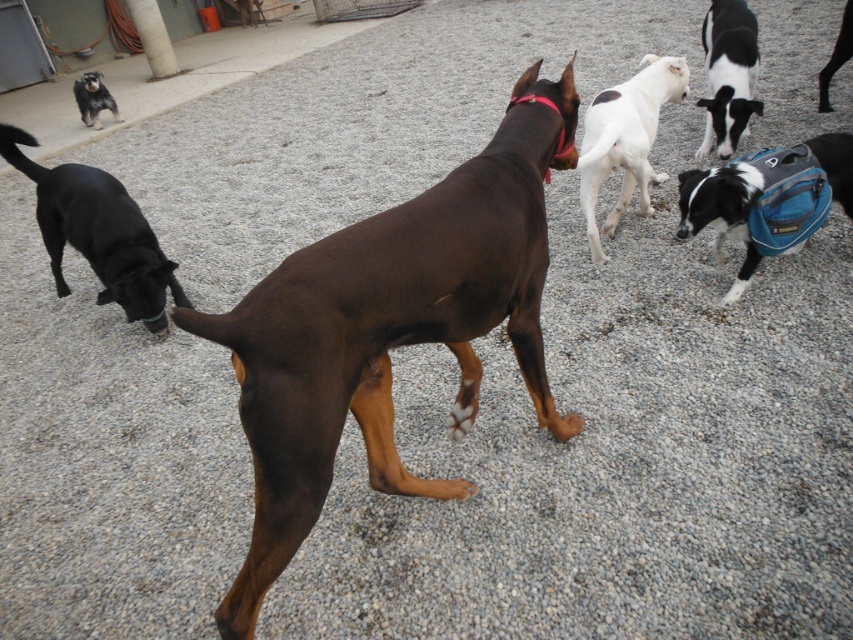
Question: Which point is farther to the camera?

Choices:
 (A) black smooth dog at left
 (B) black and white fur at upper right
 (C) brown shiny coat at center
 (D) white smooth dog at upper right

Answer: (B)

Question: Estimate the real-world distances between objects in this image. Which object is closer to the red nylon collar at center?

Choices:
 (A) black fur dog at upper left
 (B) white smooth dog at upper right
 (C) brown shiny coat at center
 (D) black smooth coat at upper right

Answer: (C)

Question: Which point is farther from the camera taking this photo?

Choices:
 (A) (138, 291)
 (B) (279, 282)
 (C) (798, 189)
 (D) (846, 49)

Answer: (D)

Question: Can you confirm if black/white fur at right is smaller than black fur dog at upper left?

Choices:
 (A) no
 (B) yes

Answer: (A)

Question: Can you confirm if white smooth dog at upper right is positioned to the right of black fur dog at upper left?

Choices:
 (A) no
 (B) yes

Answer: (B)

Question: Where is brown shiny coat at center located in relation to black and white fur at upper right in the image?

Choices:
 (A) right
 (B) left

Answer: (B)